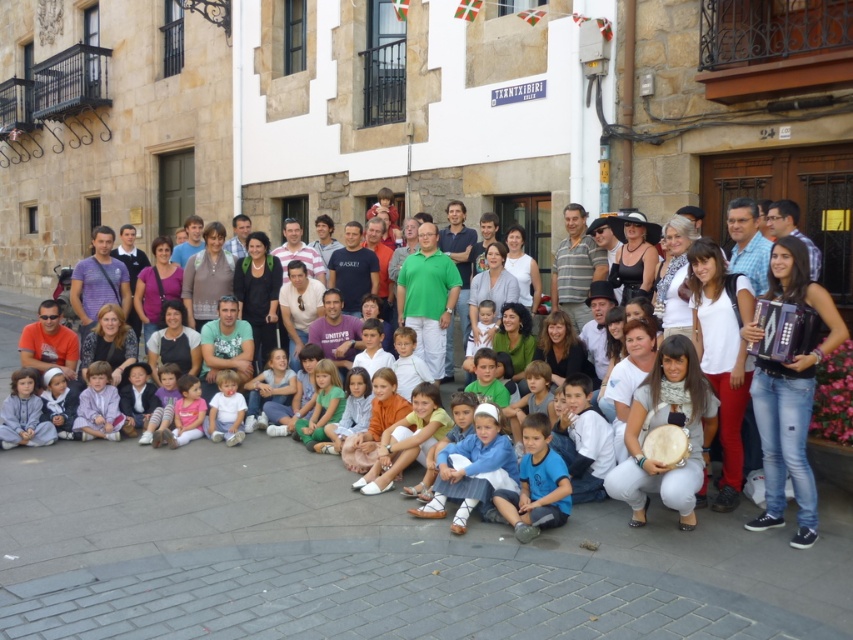
Can you confirm if white cotton shirt at center is positioned below green cotton dress at center?

Yes.

Between white cotton shirt at center and green cotton dress at center, which one is positioned lower?

white cotton shirt at center

Between point (190, 465) and point (317, 371), which one is positioned in front?

Positioned in front is point (190, 465).

Where is `white cotton shirt at center`? This screenshot has width=853, height=640. white cotton shirt at center is located at coordinates (193, 502).

Does light blue denim shorts at center appear under light blue fabric shirt at lower left?

Yes.

I want to click on light blue denim shorts at center, so click(x=473, y=468).

Who is more forward, (x=178, y=403) or (x=54, y=413)?

Positioned in front is point (x=54, y=413).

Which of these two, light pink fabric dress at lower left or matte white baby at lower left, stands shorter?

Standing shorter between the two is light pink fabric dress at lower left.

Between point (161, 436) and point (65, 396), which one is positioned in front?

Positioned in front is point (161, 436).

This screenshot has height=640, width=853. Find the location of `light pink fabric dress at lower left`. light pink fabric dress at lower left is located at coordinates (184, 413).